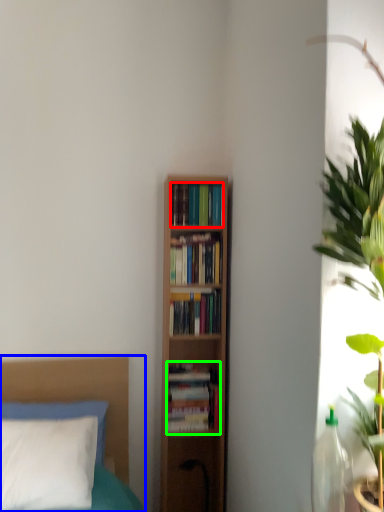
Question: Which is nearer to the book (highlighted by a red box)? bed (highlighted by a blue box) or book (highlighted by a green box).

Choices:
 (A) bed
 (B) book

Answer: (B)